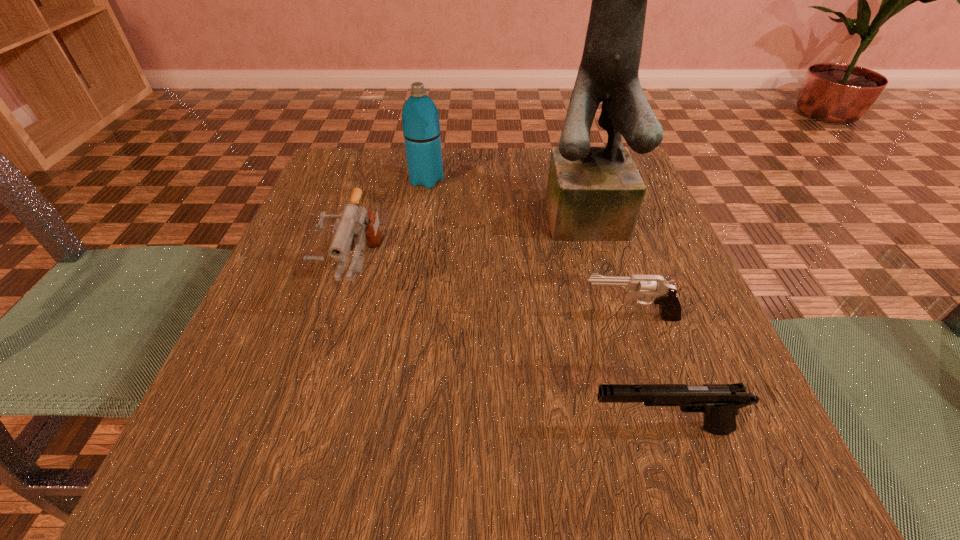
This screenshot has height=540, width=960. I want to click on free space at the left edge of the desktop, so click(328, 276).

In the image, there is a desktop. Find the location of `free space at the right edge`. free space at the right edge is located at coordinates (694, 303).

Identify the location of vacant region at the far left corner of the desktop. This screenshot has width=960, height=540. (368, 180).

Where is `vacant region at the near left corner of the desktop`? This screenshot has height=540, width=960. vacant region at the near left corner of the desktop is located at coordinates (318, 444).

Identify the location of vacant space that is in between the thermos bottle and the third shortest object. The height and width of the screenshot is (540, 960). (392, 227).

Where is `vacant space that is in between the nearest gun and the leftmost gun`? This screenshot has height=540, width=960. vacant space that is in between the nearest gun and the leftmost gun is located at coordinates (509, 351).

I want to click on blank region between the second tallest object and the sculpture, so click(511, 195).

What are the coordinates of `vacant area that lies between the tallest object and the nearest object` in the screenshot? It's located at (628, 319).

The width and height of the screenshot is (960, 540). What are the coordinates of `empty location between the thermos bottle and the third shortest object` in the screenshot? It's located at (392, 227).

What are the coordinates of `the third closest object to the leftmost gun` in the screenshot? It's located at point(663,293).